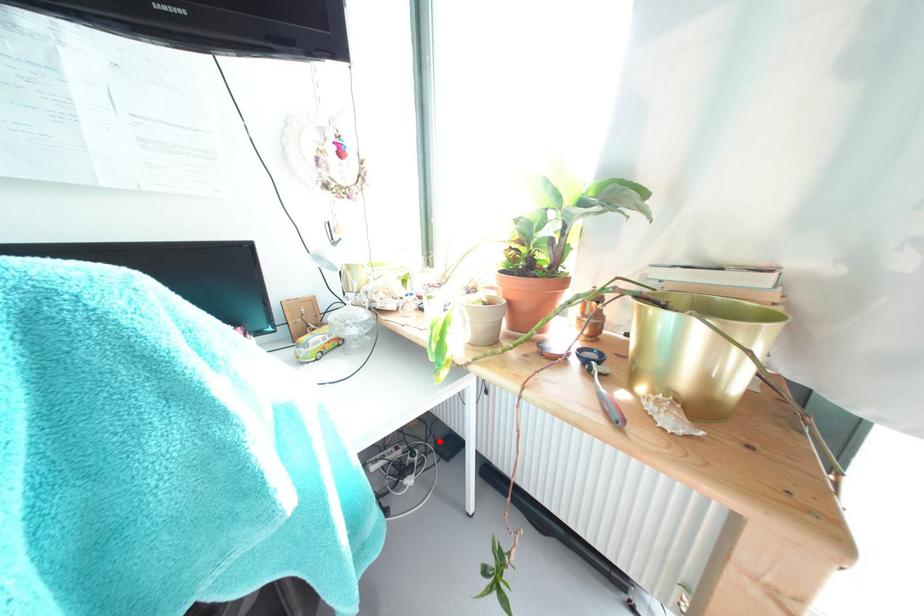
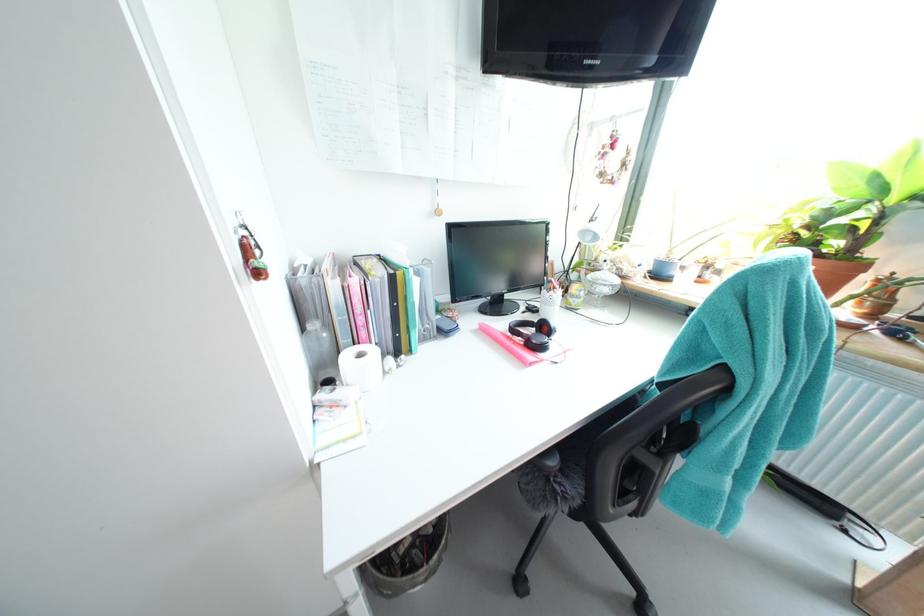
Question: I am providing you with two images of the same scene from different viewpoints. A red point is marked on the first image. Can you still see the location of the red point in image 2?

Choices:
 (A) Yes
 (B) No

Answer: (B)